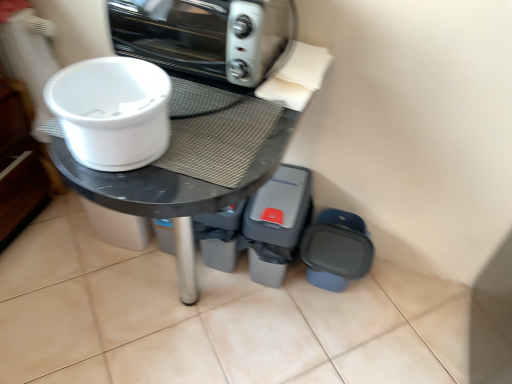
The height and width of the screenshot is (384, 512). What are the coordinates of `vacant space in front of gray plastic bin at lower right, which appears as the first appliance when viewed from the left` in the screenshot? It's located at (268, 317).